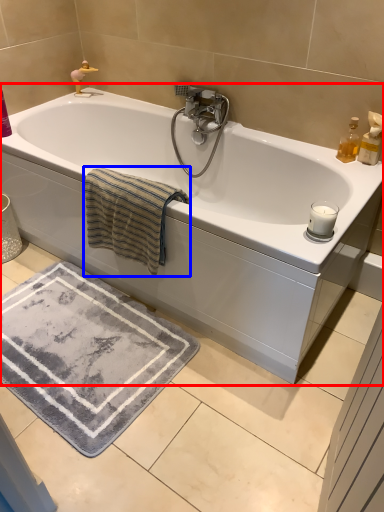
Question: Which object is further to the camera taking this photo, bathtub (highlighted by a red box) or bath towel (highlighted by a blue box)?

Choices:
 (A) bathtub
 (B) bath towel

Answer: (B)